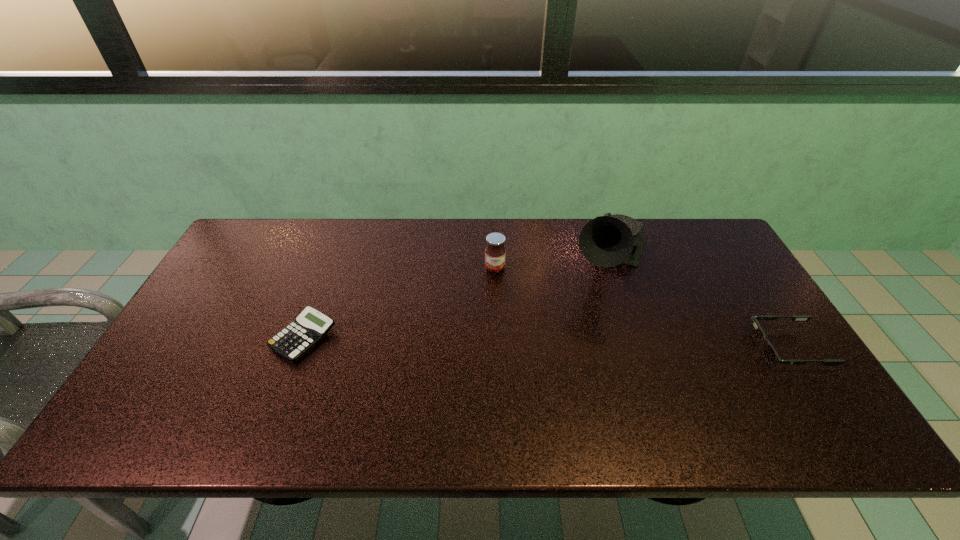
Locate an element on the screen. vacant point located between the shortest object and the jam is located at coordinates (399, 302).

Find the location of `free space between the rightmost object and the calculator`. free space between the rightmost object and the calculator is located at coordinates (545, 343).

I want to click on free point between the second object from left to right and the leftmost object, so (399, 302).

Locate an element on the screen. The image size is (960, 540). vacant area that lies between the tallest object and the shortest object is located at coordinates (457, 299).

Find the location of a particular element. vacant area between the phonograph_record and the second object from left to right is located at coordinates (553, 264).

You are a GUI agent. You are given a task and a screenshot of the screen. Output one action in this format:
    pyautogui.click(x=<x>, y=<y>)
    Task: Click on the empty space that is in between the calculator and the sunglasses
    The width and height of the screenshot is (960, 540).
    Given the screenshot: What is the action you would take?
    tap(545, 343)

Find the location of a particular element. object that can be found as the third closest to the third object from right to left is located at coordinates (770, 355).

Locate an element on the screen. Image resolution: width=960 pixels, height=540 pixels. the closest object to the third object from left to right is located at coordinates [x=770, y=355].

Locate an element on the screen. blank area in the image that satisfies the following two spatial constraints: 1. on the front side of the calculator; 2. on the temples of the third tallest object is located at coordinates tap(300, 348).

Locate an element on the screen. This screenshot has height=540, width=960. free spot that satisfies the following two spatial constraints: 1. on the front side of the rightmost object; 2. on the temples of the leftmost object is located at coordinates (300, 348).